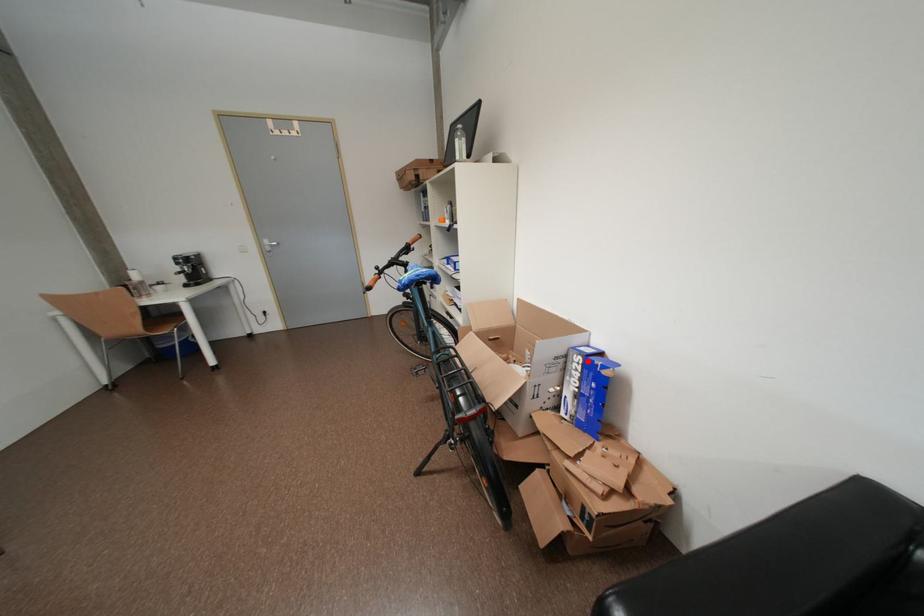
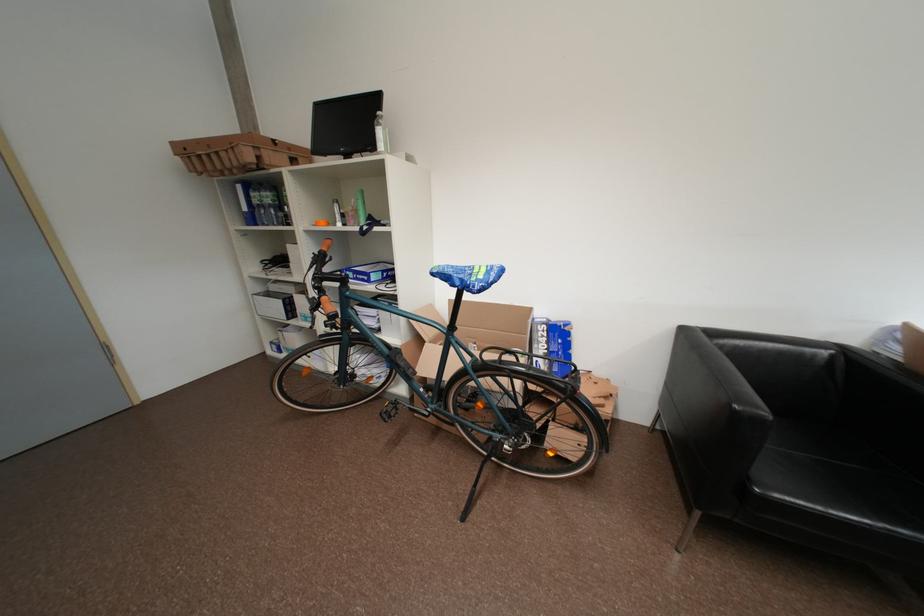
Locate, in the second image, the point that corresponds to the highlighted location in the first image.

(553, 329)